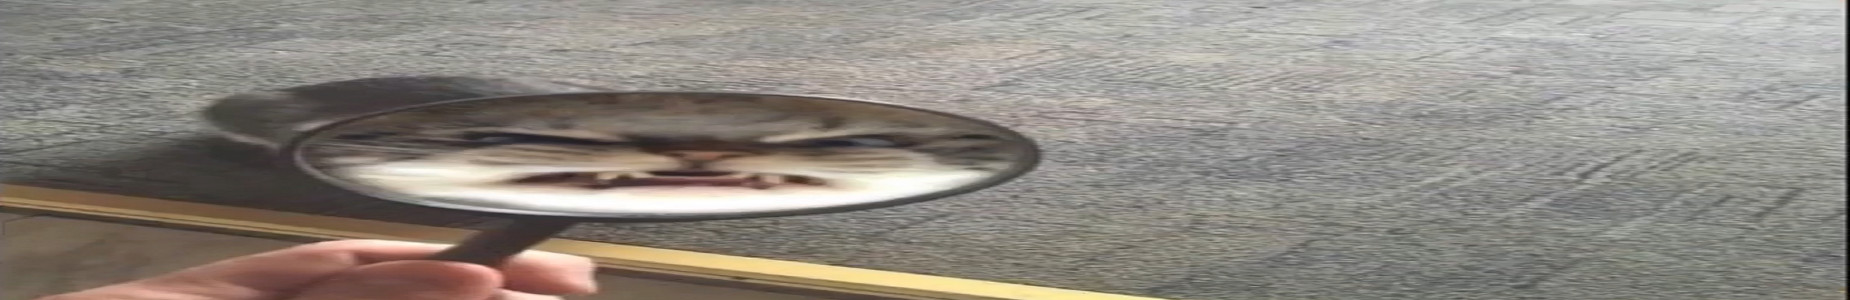
Identify the location of carpet. The height and width of the screenshot is (300, 1850). (1173, 204).